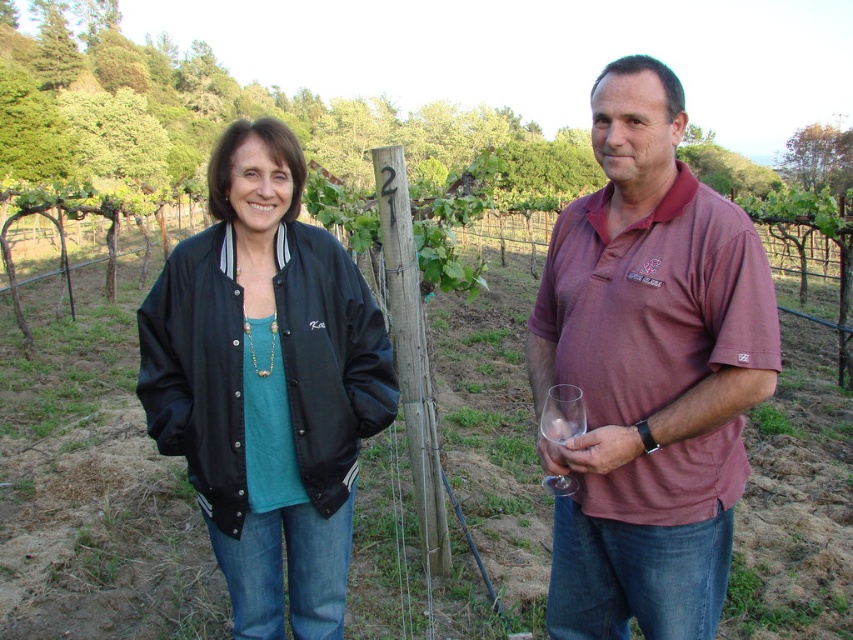
Can you confirm if black leather jacket at left is positioned below black leather jacket at center?

Yes, black leather jacket at left is below black leather jacket at center.

Does point (618, 524) lie behind point (252, 444)?

No.

At what (x,y) coordinates should I click in order to perform the action: click on black leather jacket at left. Please return your answer as a coordinate pair (x, y). Looking at the image, I should click on (648, 372).

Is black leather jacket at center in front of clear glass at right?

No.

Is black leather jacket at center taller than clear glass at right?

Correct, black leather jacket at center is much taller as clear glass at right.

Which is behind, point (248, 333) or point (566, 435)?

The point (248, 333) is behind.

Locate an element on the screen. black leather jacket at center is located at coordinates (267, 384).

Can you confirm if matte maroon polo shirt at center is shorter than black leather jacket at center?

Incorrect, matte maroon polo shirt at center's height does not fall short of black leather jacket at center's.

Find the location of a particular element. This screenshot has height=640, width=853. matte maroon polo shirt at center is located at coordinates (648, 372).

Does point (665, 160) come behind point (195, 420)?

No, (665, 160) is in front of (195, 420).

You are a GUI agent. You are given a task and a screenshot of the screen. Output one action in this format:
    pyautogui.click(x=<x>, y=<y>)
    Task: Click on the matte maroon polo shirt at center
    
    Given the screenshot: What is the action you would take?
    pyautogui.click(x=648, y=372)